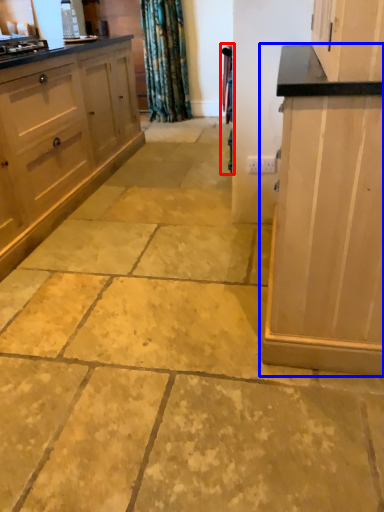
Question: Which point is further to the camera, curtain (highlighted by a red box) or cabinetry (highlighted by a blue box)?

Choices:
 (A) curtain
 (B) cabinetry

Answer: (A)